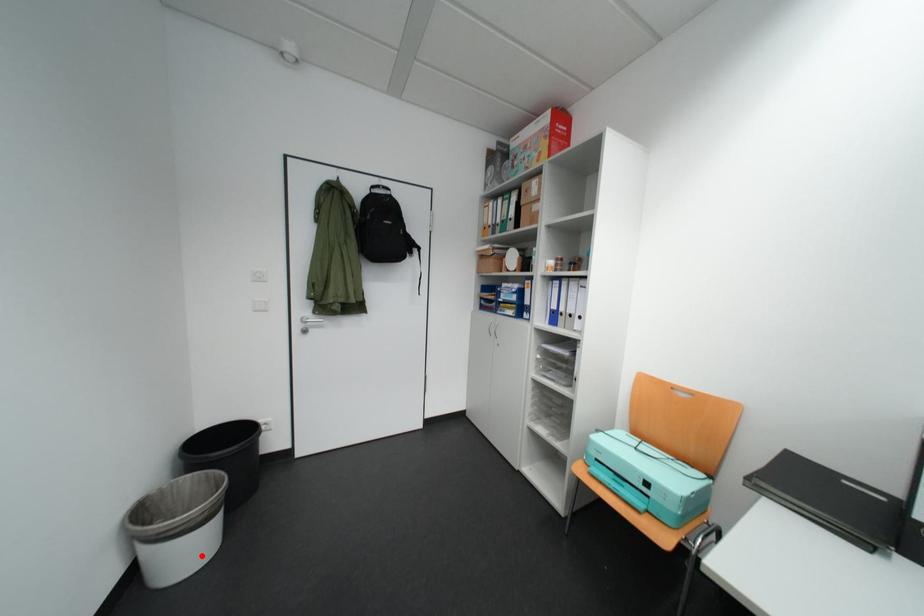
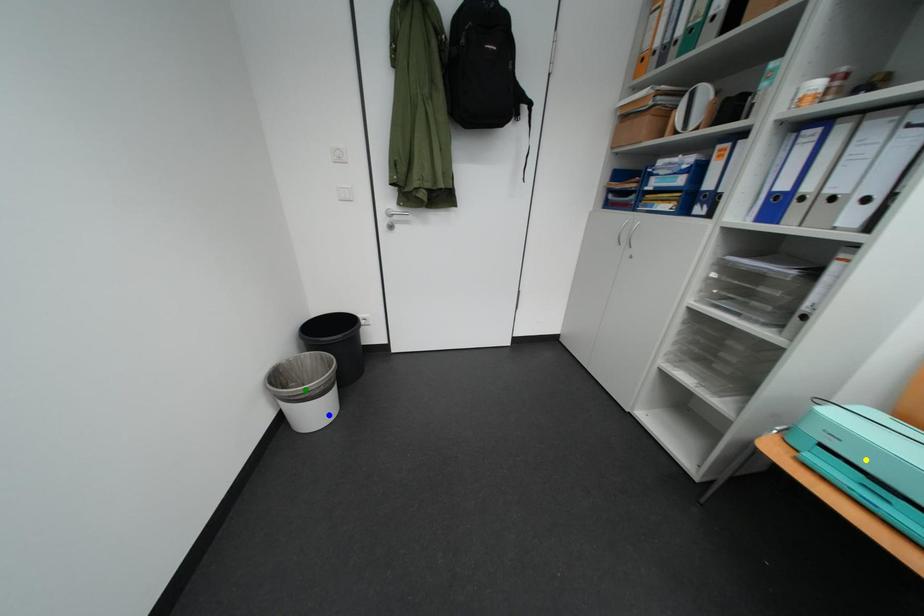
Question: I am providing you with two images of the same scene from different viewpoints. A red point is marked on the first image. You are given multiple points on the second image. Which point in image 2 is actually the same real-world point as the red point in image 1?

Choices:
 (A) green point
 (B) yellow point
 (C) blue point

Answer: (C)